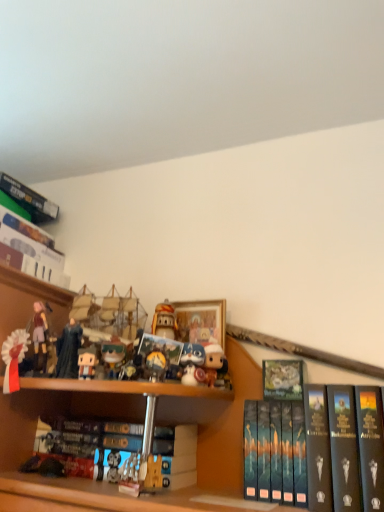
Question: Considering the relative sizes of hardcover book at upper center, the second book positioned from the right, and hardcover book at center, arranged as the 1th book when viewed from the left, in the image provided, is hardcover book at upper center, the second book positioned from the right, thinner than hardcover book at center, arranged as the 1th book when viewed from the left,?

Choices:
 (A) yes
 (B) no

Answer: (A)

Question: Is there a large distance between hardcover book at upper center, the second book positioned from the right, and hardcover book at center, which is counted as the 3th book, starting from the right?

Choices:
 (A) yes
 (B) no

Answer: (B)

Question: Is hardcover book at center, which is counted as the 3th book, starting from the right, at the back of hardcover book at upper center, the second book positioned from the right?

Choices:
 (A) no
 (B) yes

Answer: (A)

Question: Can you confirm if hardcover book at upper center, the second book positioned from the right, is positioned to the left of hardcover book at center, arranged as the 1th book when viewed from the left?

Choices:
 (A) no
 (B) yes

Answer: (A)

Question: Considering the relative sizes of hardcover book at upper center, the second book positioned from the right, and hardcover book at center, arranged as the 1th book when viewed from the left, in the image provided, is hardcover book at upper center, the second book positioned from the right, taller than hardcover book at center, arranged as the 1th book when viewed from the left,?

Choices:
 (A) yes
 (B) no

Answer: (B)

Question: Considering the positions of matte plastic figurine at center, the 2th toy viewed from the right, and white fabric ribbon at upper left, the 6th toy in the right-to-left sequence, in the image, is matte plastic figurine at center, the 2th toy viewed from the right, taller or shorter than white fabric ribbon at upper left, the 6th toy in the right-to-left sequence,?

Choices:
 (A) short
 (B) tall

Answer: (A)

Question: Relative to white fabric ribbon at upper left, which is the 1th toy from left to right, is matte plastic figurine at center, the fifth toy positioned from the left, in front or behind?

Choices:
 (A) behind
 (B) front

Answer: (A)

Question: Based on their positions, is matte plastic figurine at center, the 2th toy viewed from the right, located to the left or right of white fabric ribbon at upper left, the 6th toy in the right-to-left sequence?

Choices:
 (A) right
 (B) left

Answer: (A)

Question: Is matte plastic figurine at center, the fifth toy positioned from the left, inside or outside of white fabric ribbon at upper left, which is the 1th toy from left to right?

Choices:
 (A) inside
 (B) outside

Answer: (B)

Question: Considering the positions of matte plastic figurine at center, which ranks as the fourth toy in right-to-left order, and white plush toy at center, the sixth toy in the left-to-right sequence, in the image, is matte plastic figurine at center, which ranks as the fourth toy in right-to-left order, wider or thinner than white plush toy at center, the sixth toy in the left-to-right sequence,?

Choices:
 (A) thin
 (B) wide

Answer: (A)

Question: Based on their positions, is matte plastic figurine at center, which ranks as the fourth toy in right-to-left order, located to the left or right of white plush toy at center, which ranks as the 1th toy in right-to-left order?

Choices:
 (A) right
 (B) left

Answer: (B)

Question: Considering the positions of matte plastic figurine at center, which is the third toy in left-to-right order, and white plush toy at center, the sixth toy in the left-to-right sequence, in the image, is matte plastic figurine at center, which is the third toy in left-to-right order, taller or shorter than white plush toy at center, the sixth toy in the left-to-right sequence,?

Choices:
 (A) tall
 (B) short

Answer: (B)

Question: Considering the positions of point (81, 361) and point (201, 372), is point (81, 361) closer or farther from the camera than point (201, 372)?

Choices:
 (A) farther
 (B) closer

Answer: (B)

Question: From the image's perspective, is hardcover book at upper center, the 2th book in the left-to-right sequence, above or below hardcover book at center, arranged as the 1th book when viewed from the left?

Choices:
 (A) above
 (B) below

Answer: (A)

Question: In terms of size, does hardcover book at upper center, the 2th book in the left-to-right sequence, appear bigger or smaller than hardcover book at center, arranged as the 1th book when viewed from the left?

Choices:
 (A) big
 (B) small

Answer: (B)